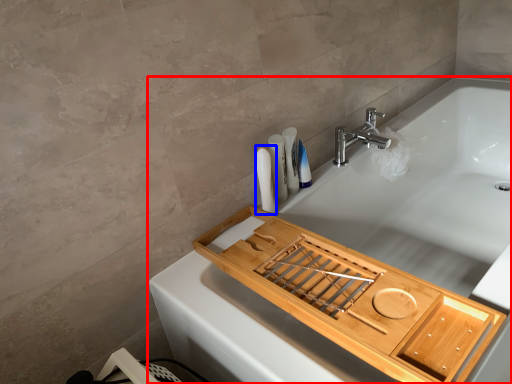
Question: Which of the following is the farthest to the observer, bathtub (highlighted by a red box) or toiletry (highlighted by a blue box)?

Choices:
 (A) bathtub
 (B) toiletry

Answer: (B)